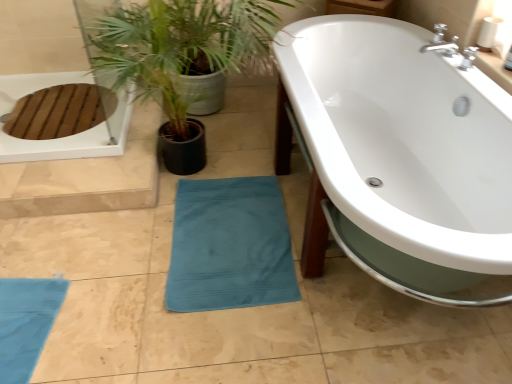
The height and width of the screenshot is (384, 512). Identify the location of teal fabric plant at lower center. (182, 48).

This screenshot has height=384, width=512. In order to click on teal cotton beach towel at lower center in this screenshot , I will do `click(230, 246)`.

Could you tell me if teal fabric plant at lower center is facing white glossy bathtub at center?

No, teal fabric plant at lower center does not turn towards white glossy bathtub at center.

Is teal fabric plant at lower center bigger or smaller than white glossy bathtub at center?

Considering their sizes, teal fabric plant at lower center takes up less space than white glossy bathtub at center.

Can you confirm if teal fabric plant at lower center is shorter than white glossy bathtub at center?

In fact, teal fabric plant at lower center may be taller than white glossy bathtub at center.

Are teal fabric plant at lower center and white glossy bathtub at center located far from each other?

No.

Is point (88, 34) closer to camera compared to point (176, 196)?

Yes, point (88, 34) is closer to viewer.

Identify the location of beach towel below the teal fabric plant at lower center (from the image's perspective). The width and height of the screenshot is (512, 384). (230, 246).

Which object is further away from the camera, teal fabric plant at lower center or teal cotton beach towel at lower center?

teal cotton beach towel at lower center is further away from the camera.

How far apart are teal fabric plant at lower center and teal cotton beach towel at lower center?

teal fabric plant at lower center and teal cotton beach towel at lower center are 23.90 inches apart.

This screenshot has height=384, width=512. Find the location of `beach towel below the white glossy bathtub at center (from a real-world perspective)`. beach towel below the white glossy bathtub at center (from a real-world perspective) is located at coordinates (230, 246).

Which is behind, point (429, 88) or point (196, 254)?

The point (429, 88) is farther from the camera.

From the image's perspective, is white glossy bathtub at center located above teal cotton beach towel at lower center?

Yes, from the image's perspective, white glossy bathtub at center is above teal cotton beach towel at lower center.

How many degrees apart are the facing directions of white glossy bathtub at center and teal cotton beach towel at lower center?

They differ by 3.5 degrees in their facing directions.

Considering the sizes of objects white glossy bathtub at center and teal fabric plant at lower center in the image provided, who is bigger, white glossy bathtub at center or teal fabric plant at lower center?

white glossy bathtub at center is bigger.

Where is `houseplant above the white glossy bathtub at center (from a real-world perspective)`? houseplant above the white glossy bathtub at center (from a real-world perspective) is located at coordinates (182, 48).

From the image's perspective, who appears lower, white glossy bathtub at center or teal fabric plant at lower center?

From the image's view, white glossy bathtub at center is below.

Does teal cotton beach towel at lower center turn towards white glossy bathtub at center?

No, teal cotton beach towel at lower center is not aimed at white glossy bathtub at center.

Is teal cotton beach towel at lower center located outside white glossy bathtub at center?

teal cotton beach towel at lower center lies outside white glossy bathtub at center's area.

Does teal cotton beach towel at lower center appear on the right side of white glossy bathtub at center?

Incorrect, teal cotton beach towel at lower center is not on the right side of white glossy bathtub at center.

Considering the positions of objects teal cotton beach towel at lower center and white glossy bathtub at center in the image provided, who is in front, teal cotton beach towel at lower center or white glossy bathtub at center?

white glossy bathtub at center is in front.

In the scene shown: In the image, is teal cotton beach towel at lower center positioned in front of or behind teal fabric plant at lower center?

Visually, teal cotton beach towel at lower center is located behind teal fabric plant at lower center.

How distant is teal cotton beach towel at lower center from teal fabric plant at lower center?

teal cotton beach towel at lower center is 23.90 inches away from teal fabric plant at lower center.

Locate an element on the screen. The width and height of the screenshot is (512, 384). houseplant located above the teal cotton beach towel at lower center (from a real-world perspective) is located at coordinates (182, 48).

Which is closer, (289, 277) or (180, 59)?

Point (289, 277) is positioned closer to the camera compared to point (180, 59).

The height and width of the screenshot is (384, 512). I want to click on houseplant located above the white glossy bathtub at center (from the image's perspective), so tap(182, 48).

Find the location of a particular element. The image size is (512, 384). beach towel below the teal fabric plant at lower center (from the image's perspective) is located at coordinates (230, 246).

Based on their spatial positions, is teal fabric plant at lower center or white glossy bathtub at center closer to teal cotton beach towel at lower center?

white glossy bathtub at center is closer to teal cotton beach towel at lower center.

Looking at this image, looking at the image, which one is located further to teal fabric plant at lower center, teal cotton beach towel at lower center or white glossy bathtub at center?

Among the two, teal cotton beach towel at lower center is located further to teal fabric plant at lower center.

Considering their positions, is teal fabric plant at lower center positioned closer to white glossy bathtub at center than teal cotton beach towel at lower center?

teal cotton beach towel at lower center is closer to white glossy bathtub at center.

Looking at the image, which one is located further to teal cotton beach towel at lower center, white glossy bathtub at center or teal fabric plant at lower center?

teal fabric plant at lower center is positioned further to the anchor teal cotton beach towel at lower center.

From the image, which object appears to be nearer to teal fabric plant at lower center, white glossy bathtub at center or teal cotton beach towel at lower center?

white glossy bathtub at center.

Considering their positions, is teal cotton beach towel at lower center positioned further to white glossy bathtub at center than teal fabric plant at lower center?

Among the two, teal fabric plant at lower center is located further to white glossy bathtub at center.

The width and height of the screenshot is (512, 384). I want to click on beach towel situated between teal fabric plant at lower center and white glossy bathtub at center from left to right, so click(x=230, y=246).